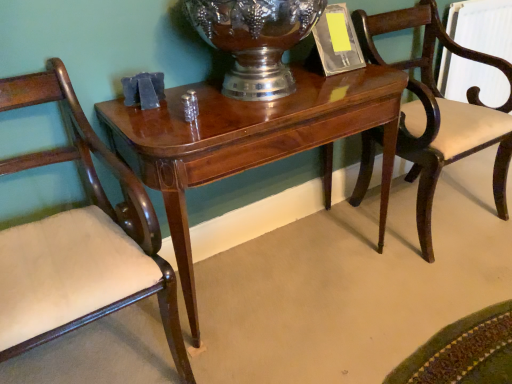
Question: Is shiny silver vase at center spatially inside shiny wood table at center, or outside of it?

Choices:
 (A) outside
 (B) inside

Answer: (A)

Question: In the image, is shiny silver vase at center on the left side or the right side of shiny wood table at center?

Choices:
 (A) left
 (B) right

Answer: (A)

Question: Which is farther from the shiny silver vase at center?

Choices:
 (A) mahogany wood chair at left, arranged as the first chair when viewed from the left
 (B) shiny wood table at center
 (C) mahogany wood chair at right, the first chair when ordered from right to left

Answer: (C)

Question: Which of these objects is positioned closest to the mahogany wood chair at left, arranged as the first chair when viewed from the left?

Choices:
 (A) shiny silver vase at center
 (B) mahogany wood chair at right, placed as the 2th chair when sorted from left to right
 (C) shiny wood table at center

Answer: (C)